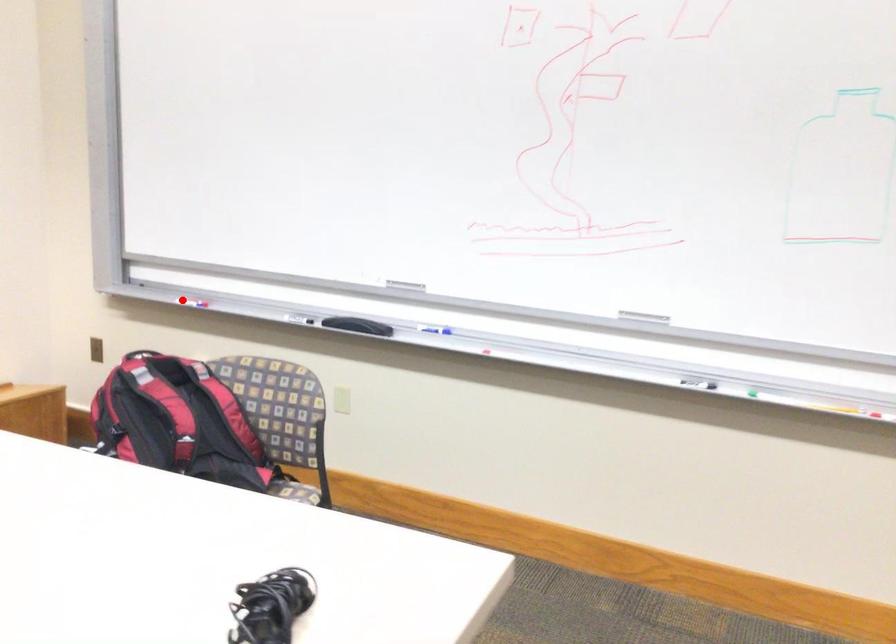
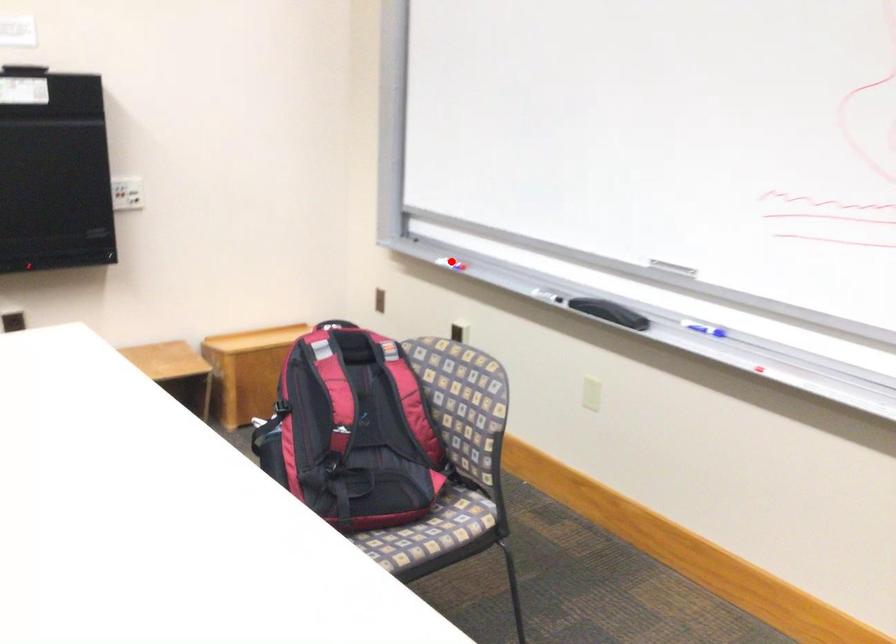
I am providing you with two images of the same scene from different viewpoints. A red point is marked on the first image and another point is marked on the second image. Do the highlighted points in image1 and image2 indicate the same real-world spot?

Yes